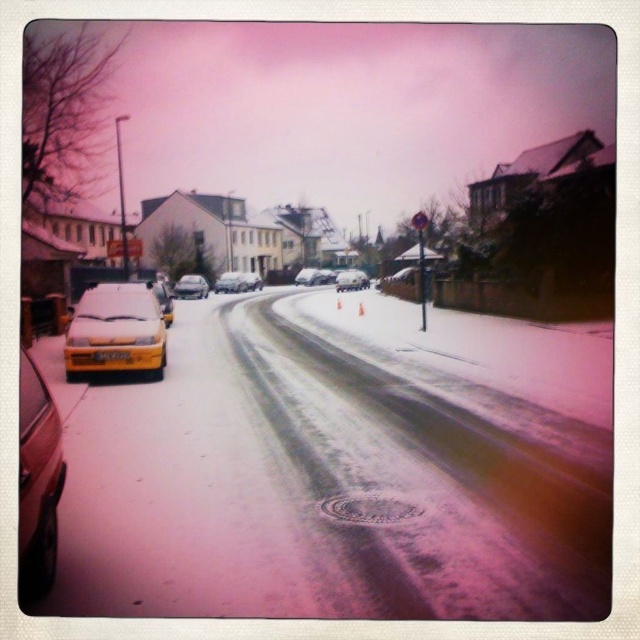
Question: Does metallic gold car at left have a smaller size compared to yellow matte car at center?

Choices:
 (A) yes
 (B) no

Answer: (A)

Question: Is the position of shiny silver sedan at center less distant than that of yellow matte car at left?

Choices:
 (A) yes
 (B) no

Answer: (B)

Question: Which object appears closest to the camera in this image?

Choices:
 (A) yellow matte taxi at left
 (B) shiny silver sedan at center

Answer: (A)

Question: Which point is closer to the camera?

Choices:
 (A) (369, 280)
 (B) (154, 284)

Answer: (B)

Question: Which point is closer to the camera?

Choices:
 (A) (172, 316)
 (B) (316, 282)
 (C) (241, 291)

Answer: (A)

Question: Does yellow matte taxi at left have a greater width compared to silver metallic sedan at center?

Choices:
 (A) no
 (B) yes

Answer: (A)